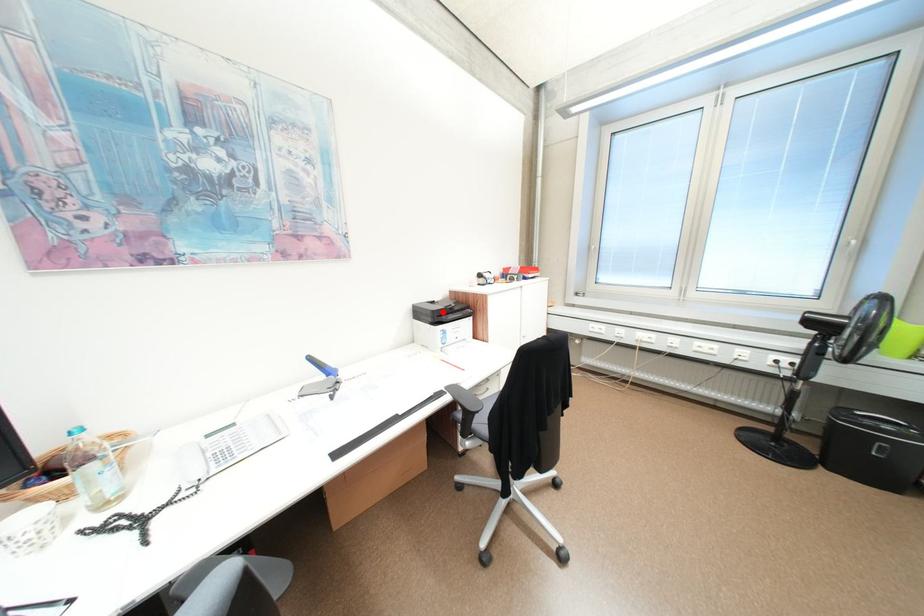
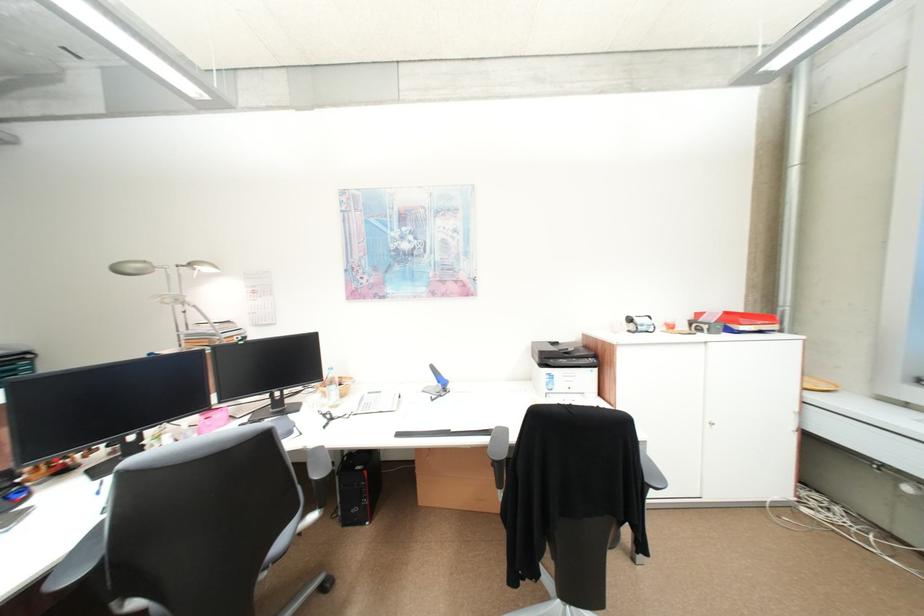
Locate, in the second image, the point that corresponds to the highlighted location in the first image.

(551, 353)